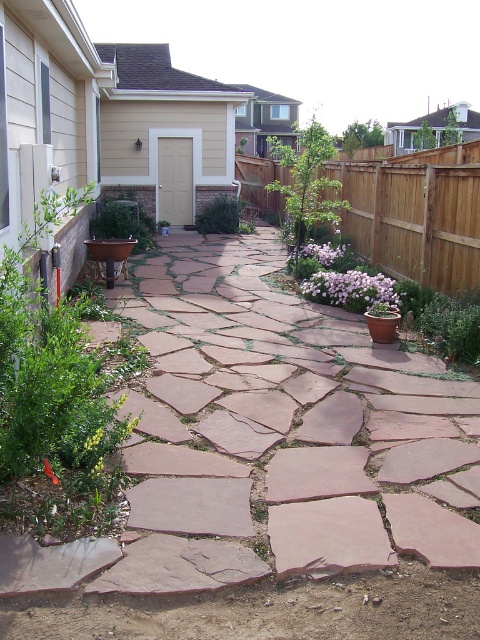
Question: Which of the following is the closest to the observer?

Choices:
 (A) tap(415, 220)
 (B) tap(308, 244)

Answer: (A)

Question: Which point appears farthest from the camera in this image?

Choices:
 (A) (134, 250)
 (B) (338, 273)
 (C) (418, 179)

Answer: (A)

Question: Is green leafy plant at left below green leafy plant at center?

Choices:
 (A) no
 (B) yes

Answer: (B)

Question: Is white matte flower at center smaller than green leafy plant at left?

Choices:
 (A) yes
 (B) no

Answer: (A)

Question: Which object appears farthest from the camera in this image?

Choices:
 (A) brown wooden fence at upper right
 (B) green leafy plant at left
 (C) pink matte flower at center

Answer: (B)

Question: Does brown wooden fence at upper right have a smaller size compared to green leafy plant at center?

Choices:
 (A) yes
 (B) no

Answer: (B)